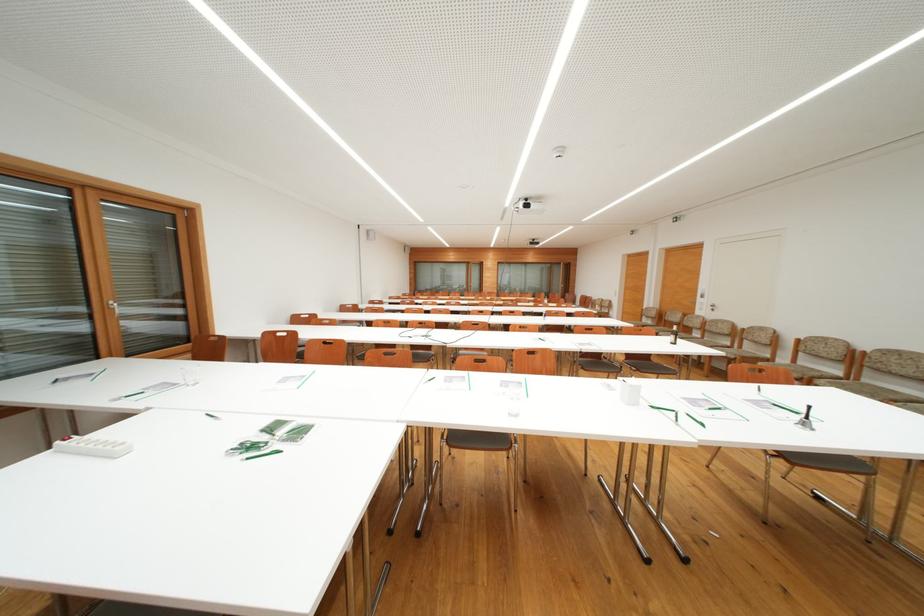
You are a GUI agent. You are given a task and a screenshot of the screen. Output one action in this format:
    pyautogui.click(x=<x>, y=<y>)
    Task: Click on the clear drinking glass
    
    Given the screenshot: What is the action you would take?
    pyautogui.click(x=189, y=375)